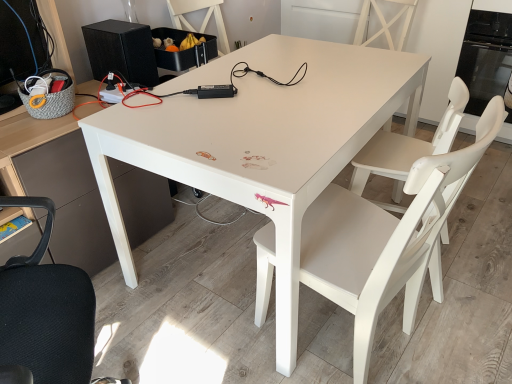
You are a GUI agent. You are given a task and a screenshot of the screen. Output one action in this format:
    pyautogui.click(x=<x>, y=<y>)
    Task: Click on the free location in front of white matte chair at center
    The height and width of the screenshot is (384, 512).
    Given the screenshot: What is the action you would take?
    pyautogui.click(x=462, y=329)